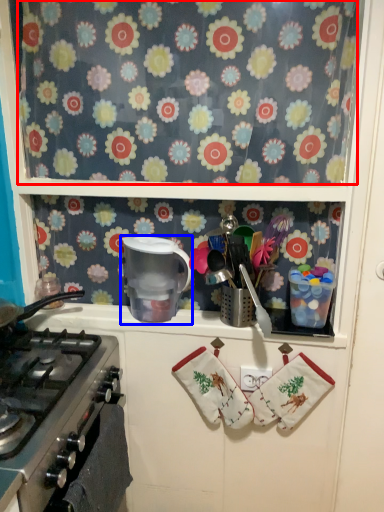
Question: Which of the following is the farthest to the observer, flower (highlighted by a red box) or appliance (highlighted by a blue box)?

Choices:
 (A) flower
 (B) appliance

Answer: (B)